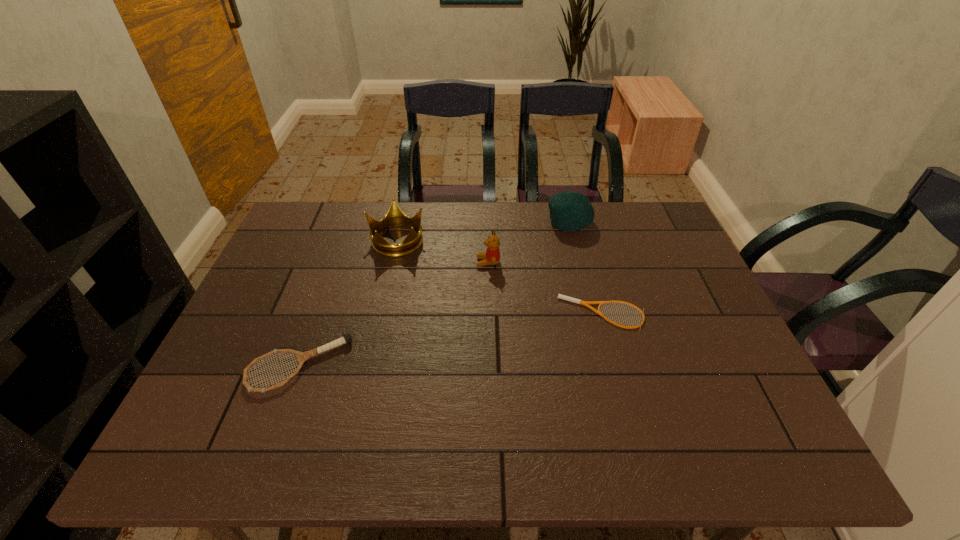
Find the location of a particular element. The width and height of the screenshot is (960, 540). blank region between the shorter tennis racket and the teddy bear is located at coordinates (545, 288).

Where is `free point between the nearest object and the shortest object`? The width and height of the screenshot is (960, 540). free point between the nearest object and the shortest object is located at coordinates (450, 339).

Find the location of `free space between the shortest object and the beanie`. free space between the shortest object and the beanie is located at coordinates (586, 268).

The width and height of the screenshot is (960, 540). Identify the location of object that can be found as the closest to the nearest object. pos(395,217).

Identify which object is located as the fourth nearest to the crown. Please provide its 2D coordinates. Your answer should be formatted as a tuple, i.e. [(x, y)], where the tuple contains the x and y coordinates of a point satisfying the conditions above.

[(585, 303)]

I want to click on free spot that satisfies the following two spatial constraints: 1. on the back side of the fourth farthest object; 2. on the front-facing side of the third object from right to left, so [588, 262].

The height and width of the screenshot is (540, 960). In order to click on free space that satisfies the following two spatial constraints: 1. on the back side of the right tennis racket; 2. on the front-facing side of the teddy bear in this screenshot , I will do `click(588, 262)`.

This screenshot has height=540, width=960. I want to click on free space that satisfies the following two spatial constraints: 1. on the front-facing side of the farther tennis racket; 2. on the right side of the teddy bear, so click(x=489, y=313).

In order to click on vacant space that satisfies the following two spatial constraints: 1. on the front side of the beanie; 2. on the left side of the right tennis racket in this screenshot , I will do `click(591, 313)`.

The height and width of the screenshot is (540, 960). Identify the location of vacant space that satisfies the following two spatial constraints: 1. on the front-facing side of the fourth farthest object; 2. on the right side of the teddy bear. (489, 313).